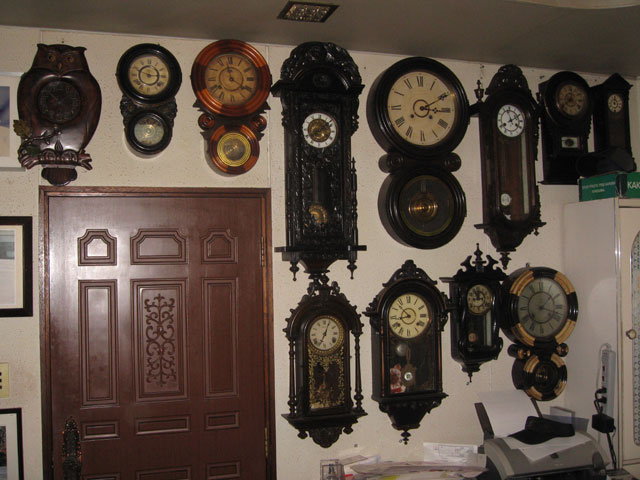
Identify the location of clocks with ornately carved woodwork. Image resolution: width=640 pixels, height=480 pixels. (342, 187), (317, 302), (417, 284), (470, 275).